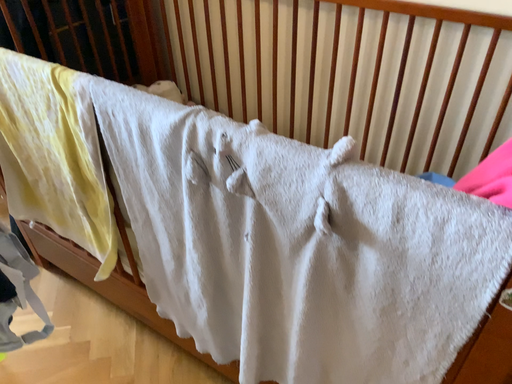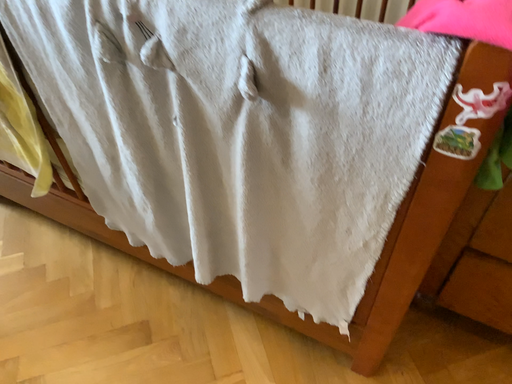
Question: How did the camera likely rotate when shooting the video?

Choices:
 (A) rotated upward
 (B) rotated downward

Answer: (B)